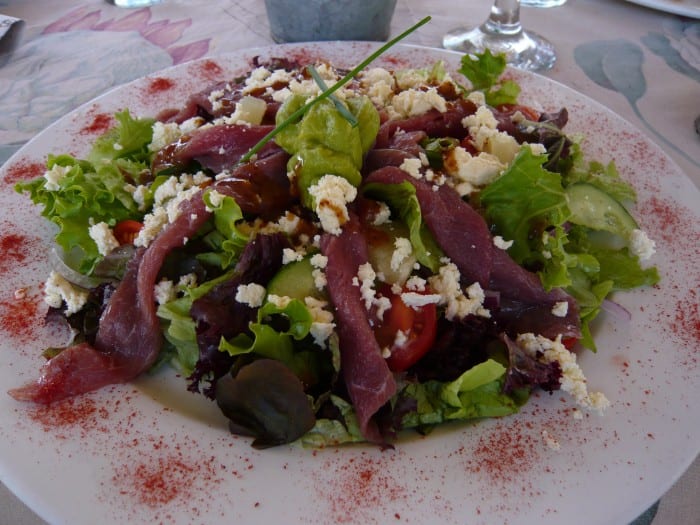
The width and height of the screenshot is (700, 525). I want to click on glass stem, so click(x=511, y=21).